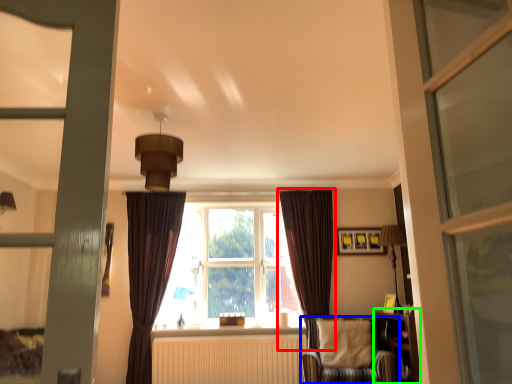
Question: Considering the real-world distances, which object is closest to curtain (highlighted by a red box)? chair (highlighted by a blue box) or bookshelf (highlighted by a green box).

Choices:
 (A) chair
 (B) bookshelf

Answer: (A)